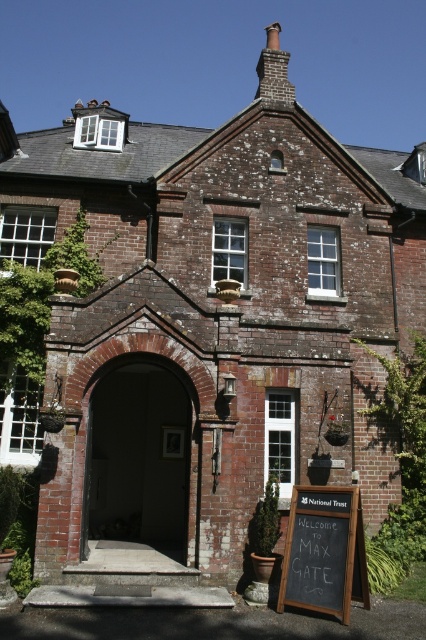
Locate an element on the screen. This screenshot has height=640, width=426. brick archway at center is located at coordinates (138, 458).

Is brick archway at center below black chalkboard at lower right?

Incorrect, brick archway at center is not positioned below black chalkboard at lower right.

Who is more forward, (94, 492) or (316, 589)?

Point (316, 589)

The image size is (426, 640). Find the location of `brick archway at center`. brick archway at center is located at coordinates (138, 458).